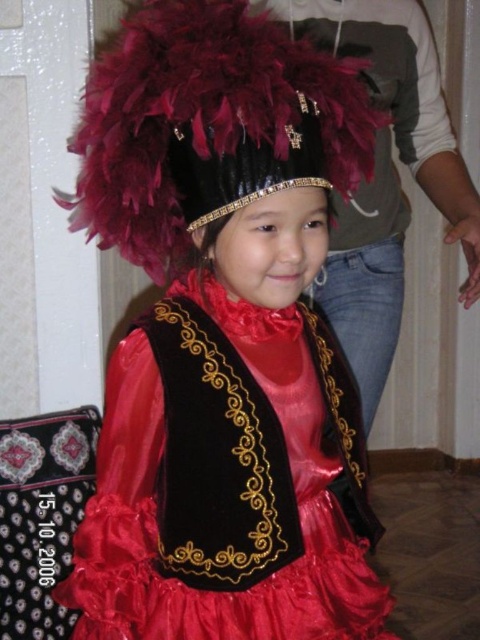
You are taking a photo of the girl in her costume. You want to focus on the point at point (291, 324) and point (192, 42). Which point should you focus on first to ensure both are in focus?

Point (291, 324) is further to the camera than point (192, 42). To ensure both are in focus, focus on the closer point first, which is point (192, 42).

You are a photographer setting up for a photo shoot with the young girl wearing the velvet satin dress at center and the feathered black headdress at upper center. You want to ensure both elements are clearly visible in the photo. Which object should you focus on first to frame the shot properly?

The feathered black headdress at upper center should be focused on first because it occupies more space than the velvet satin dress at center, ensuring it is properly framed and visible in the photo.

You are a photographer setting up for a cultural event. You need to ensure the velvet satin dress at center and the feathered black headdress at upper center are both visible in the frame. Based on their positions, which object should be placed closer to the left side of the camera to keep both in view?

The velvet satin dress at center is positioned on the right side of the feathered black headdress at upper center. To keep both in view, the feathered black headdress at upper center should be placed closer to the left side of the camera so that the velvet satin dress at center is on its right, maintaining their spatial relationship.